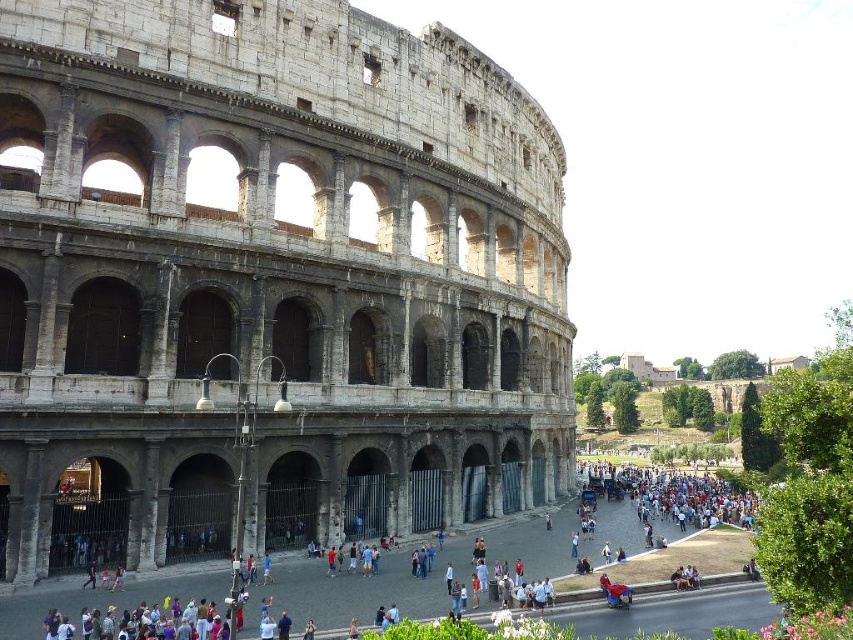
Question: Does gray stone amphitheater at center have a smaller size compared to matte gray crowd at center?

Choices:
 (A) no
 (B) yes

Answer: (A)

Question: Which point is farther from the camera taking this photo?

Choices:
 (A) (347, 611)
 (B) (10, 422)

Answer: (A)

Question: Does gray stone amphitheater at center appear on the left side of matte gray crowd at center?

Choices:
 (A) no
 (B) yes

Answer: (B)

Question: Does gray stone amphitheater at center appear under matte gray crowd at center?

Choices:
 (A) yes
 (B) no

Answer: (B)

Question: Among these points, which one is farthest from the camera?

Choices:
 (A) (544, 474)
 (B) (711, 536)

Answer: (A)

Question: Which of the following is the closest to the observer?

Choices:
 (A) (432, 269)
 (B) (364, 589)

Answer: (B)